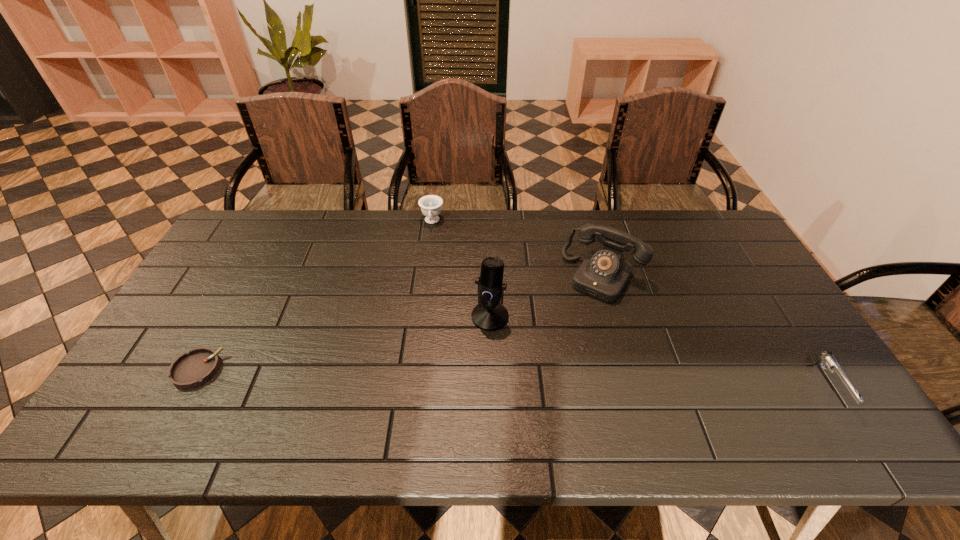
Identify the location of ashtray. The height and width of the screenshot is (540, 960). (195, 368).

In order to click on the leftmost object in this screenshot , I will do `click(195, 368)`.

Where is `the rightmost object`? The height and width of the screenshot is (540, 960). the rightmost object is located at coordinates (821, 357).

Where is `the fourth object from left to right`? Image resolution: width=960 pixels, height=540 pixels. the fourth object from left to right is located at coordinates (603, 274).

At what (x,y) coordinates should I click in order to perform the action: click on the fourth shortest object. Please return your answer as a coordinate pair (x, y). This screenshot has height=540, width=960. Looking at the image, I should click on (603, 274).

The height and width of the screenshot is (540, 960). I want to click on the third object from left to right, so click(x=489, y=315).

Image resolution: width=960 pixels, height=540 pixels. In order to click on microphone in this screenshot , I will do `click(489, 315)`.

Where is `teacup`? teacup is located at coordinates (x=430, y=205).

Where is `the second object from left to right`? Image resolution: width=960 pixels, height=540 pixels. the second object from left to right is located at coordinates (430, 205).

Image resolution: width=960 pixels, height=540 pixels. I want to click on vacant space located on the right of the ashtray, so click(240, 370).